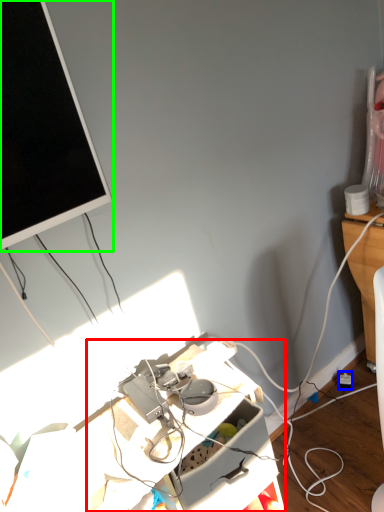
Question: Which object is positioned closest to computer desk (highlighted by a red box)? Select from power outlet (highlighted by a blue box) and television (highlighted by a green box).

Choices:
 (A) power outlet
 (B) television

Answer: (B)